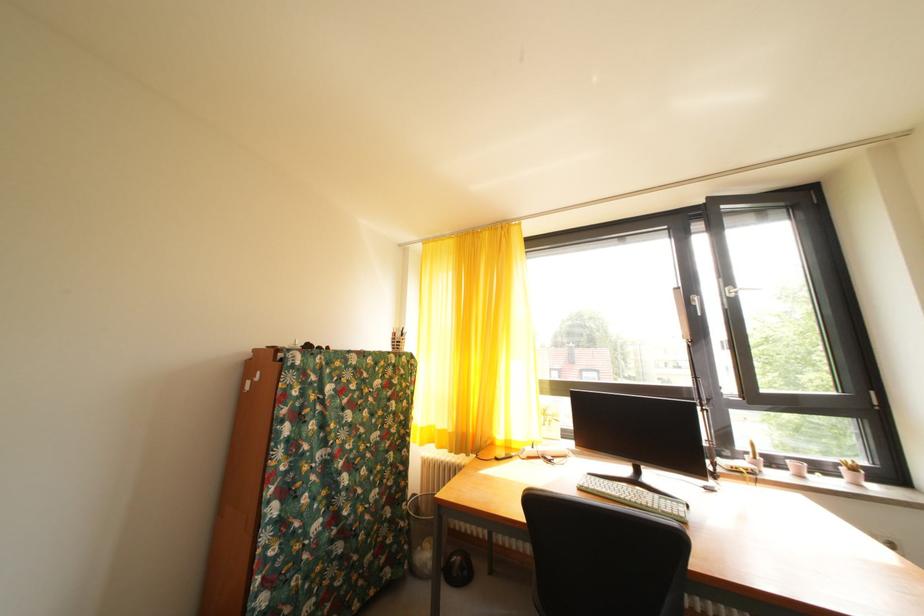
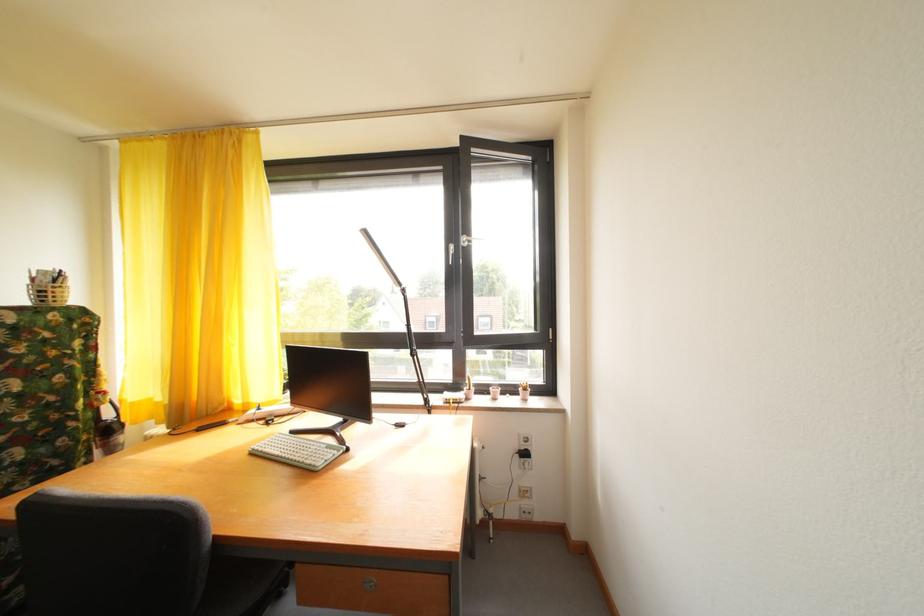
Find the pixel in the second image that matches (x=782, y=468) in the first image.

(492, 395)